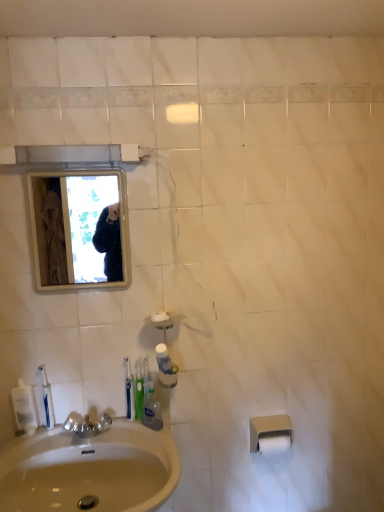
Find the location of a particular element. The height and width of the screenshot is (512, 384). beige ceramic sink at lower left is located at coordinates (89, 469).

Where is `clear plastic mouthwash at lower left, the second mouthwash from the right`? The width and height of the screenshot is (384, 512). clear plastic mouthwash at lower left, the second mouthwash from the right is located at coordinates (45, 399).

Image resolution: width=384 pixels, height=512 pixels. I want to click on green plastic toothbrush at sink, the first toothbrush when ordered from right to left, so coord(139,390).

I want to click on clear plastic mouthwash at lower left, marked as the first mouthwash in a left-to-right arrangement, so click(25, 407).

Where is `beige ceramic sink at lower left`? Image resolution: width=384 pixels, height=512 pixels. beige ceramic sink at lower left is located at coordinates (89, 469).

Does white matte toilet paper at lower right, marked as the first toilet paper in a bottom-to-top arrangement, contain beige matte toilet paper at lower right, positioned as the first toilet paper in top-to-bottom order?

No.

Is white matte toilet paper at lower right, which appears as the second toilet paper when viewed from the top, looking in the opposite direction of beige matte toilet paper at lower right, positioned as the first toilet paper in top-to-bottom order?

Correct, white matte toilet paper at lower right, which appears as the second toilet paper when viewed from the top, is looking away from beige matte toilet paper at lower right, positioned as the first toilet paper in top-to-bottom order.

Is white matte toilet paper at lower right, which appears as the second toilet paper when viewed from the top, to the left or to the right of beige matte toilet paper at lower right, arranged as the 2th toilet paper when ordered from the bottom, in the image?

white matte toilet paper at lower right, which appears as the second toilet paper when viewed from the top, is positioned on beige matte toilet paper at lower right, arranged as the 2th toilet paper when ordered from the bottom,'s right side.

In terms of height, does white matte toilet paper at lower right, marked as the first toilet paper in a bottom-to-top arrangement, look taller or shorter compared to beige matte toilet paper at lower right, arranged as the 2th toilet paper when ordered from the bottom?

white matte toilet paper at lower right, marked as the first toilet paper in a bottom-to-top arrangement, is shorter than beige matte toilet paper at lower right, arranged as the 2th toilet paper when ordered from the bottom.

Can you tell me how much beige matte toilet paper at lower right, positioned as the first toilet paper in top-to-bottom order, and white plastic toothbrush at lower left, which is the 2th toothbrush from right to left, differ in facing direction?

0.502 degrees.

Is beige matte toilet paper at lower right, positioned as the first toilet paper in top-to-bottom order, positioned beyond the bounds of white plastic toothbrush at lower left, which is the 2th toothbrush from right to left?

beige matte toilet paper at lower right, positioned as the first toilet paper in top-to-bottom order, lies outside white plastic toothbrush at lower left, which is the 2th toothbrush from right to left,'s area.

Locate an element on the screen. the 1st toilet paper positioned below the white plastic toothbrush at lower left, the first toothbrush in the left-to-right sequence (from the image's perspective) is located at coordinates (270, 434).

From the picture: Does white matte toilet paper at lower right, marked as the first toilet paper in a bottom-to-top arrangement, have a lesser height compared to white plastic toothbrush at lower left, the first toothbrush in the left-to-right sequence?

Indeed, white matte toilet paper at lower right, marked as the first toilet paper in a bottom-to-top arrangement, has a lesser height compared to white plastic toothbrush at lower left, the first toothbrush in the left-to-right sequence.

From the image's perspective, is white matte toilet paper at lower right, which appears as the second toilet paper when viewed from the top, on top of white plastic toothbrush at lower left, the first toothbrush in the left-to-right sequence?

No, from the image's perspective, white matte toilet paper at lower right, which appears as the second toilet paper when viewed from the top, is not on top of white plastic toothbrush at lower left, the first toothbrush in the left-to-right sequence.

Which is nearer, [271,446] or [125,360]?

Clearly, point [271,446] is more distant from the camera than point [125,360].

Is the position of white matte toilet paper at lower right, which appears as the second toilet paper when viewed from the top, more distant than that of white plastic toothbrush at lower left, the first toothbrush in the left-to-right sequence?

That is True.

Is white matte toilet paper at lower right, marked as the first toilet paper in a bottom-to-top arrangement, thinner than clear plastic mouthwash at lower left, marked as the first mouthwash in a left-to-right arrangement?

Incorrect, the width of white matte toilet paper at lower right, marked as the first toilet paper in a bottom-to-top arrangement, is not less than that of clear plastic mouthwash at lower left, marked as the first mouthwash in a left-to-right arrangement.

Choose the correct answer: Is white matte toilet paper at lower right, which appears as the second toilet paper when viewed from the top, inside clear plastic mouthwash at lower left, marked as the first mouthwash in a left-to-right arrangement, or outside it?

white matte toilet paper at lower right, which appears as the second toilet paper when viewed from the top, is located beyond the bounds of clear plastic mouthwash at lower left, marked as the first mouthwash in a left-to-right arrangement.

Consider the image. Which is more to the right, white matte toilet paper at lower right, marked as the first toilet paper in a bottom-to-top arrangement, or beige ceramic sink at lower left?

white matte toilet paper at lower right, marked as the first toilet paper in a bottom-to-top arrangement, is more to the right.

Is there a large distance between white matte toilet paper at lower right, marked as the first toilet paper in a bottom-to-top arrangement, and beige ceramic sink at lower left?

white matte toilet paper at lower right, marked as the first toilet paper in a bottom-to-top arrangement, is actually quite close to beige ceramic sink at lower left.

Which object is closer to the camera taking this photo, white matte toilet paper at lower right, marked as the first toilet paper in a bottom-to-top arrangement, or beige ceramic sink at lower left?

Positioned in front is beige ceramic sink at lower left.

Is white matte toilet paper at lower right, which appears as the second toilet paper when viewed from the top, positioned with its back to beige ceramic sink at lower left?

No, white matte toilet paper at lower right, which appears as the second toilet paper when viewed from the top, is not facing away from beige ceramic sink at lower left.

Which of these two, clear plastic mouthwash at lower left, marked as the first mouthwash in a left-to-right arrangement, or translucent plastic mouthwash at lower center, which is the 3th mouthwash from left to right, is thinner?

clear plastic mouthwash at lower left, marked as the first mouthwash in a left-to-right arrangement.

Can you tell me how much clear plastic mouthwash at lower left, the 3th mouthwash when ordered from right to left, and translucent plastic mouthwash at lower center, which is the 3th mouthwash from left to right, differ in facing direction?

There is a 48.4-degree angle between the facing directions of clear plastic mouthwash at lower left, the 3th mouthwash when ordered from right to left, and translucent plastic mouthwash at lower center, which is the 3th mouthwash from left to right.

Could you measure the distance between clear plastic mouthwash at lower left, the 3th mouthwash when ordered from right to left, and translucent plastic mouthwash at lower center, the first mouthwash from the right?

clear plastic mouthwash at lower left, the 3th mouthwash when ordered from right to left, and translucent plastic mouthwash at lower center, the first mouthwash from the right, are 41.83 centimeters apart from each other.

Where is `mouthwash that is below the translucent plastic mouthwash at lower center, the first mouthwash from the right (from the image's perspective)`? The image size is (384, 512). mouthwash that is below the translucent plastic mouthwash at lower center, the first mouthwash from the right (from the image's perspective) is located at coordinates (25, 407).

From the picture: Considering the sizes of objects beige ceramic sink at lower left and green plastic toothbrush at sink, the second toothbrush in the left-to-right sequence, in the image provided, who is thinner, beige ceramic sink at lower left or green plastic toothbrush at sink, the second toothbrush in the left-to-right sequence,?

green plastic toothbrush at sink, the second toothbrush in the left-to-right sequence, is thinner.

Is beige ceramic sink at lower left aimed at green plastic toothbrush at sink, the first toothbrush when ordered from right to left?

No, beige ceramic sink at lower left is not facing towards green plastic toothbrush at sink, the first toothbrush when ordered from right to left.

Consider the image. Is beige ceramic sink at lower left shorter than green plastic toothbrush at sink, the first toothbrush when ordered from right to left?

In fact, beige ceramic sink at lower left may be taller than green plastic toothbrush at sink, the first toothbrush when ordered from right to left.

Considering the sizes of objects beige ceramic sink at lower left and green plastic toothbrush at sink, the second toothbrush in the left-to-right sequence, in the image provided, who is bigger, beige ceramic sink at lower left or green plastic toothbrush at sink, the second toothbrush in the left-to-right sequence,?

beige ceramic sink at lower left.

Locate an element on the screen. The height and width of the screenshot is (512, 384). toilet paper on the right of beige matte toilet paper at lower right, arranged as the 2th toilet paper when ordered from the bottom is located at coordinates click(x=274, y=444).

Where is `the 1st toothbrush positioned above the beige matte toilet paper at lower right, arranged as the 2th toilet paper when ordered from the bottom (from the image's perspective)`? This screenshot has height=512, width=384. the 1st toothbrush positioned above the beige matte toilet paper at lower right, arranged as the 2th toilet paper when ordered from the bottom (from the image's perspective) is located at coordinates click(x=129, y=389).

When comparing their distances from translucent plastic mouthwash at lower center, which is the 3th mouthwash from left to right, does white matte toilet paper at lower right, which appears as the second toilet paper when viewed from the top, or beige matte toilet paper at lower right, positioned as the first toilet paper in top-to-bottom order, seem further?

Based on the image, white matte toilet paper at lower right, which appears as the second toilet paper when viewed from the top, appears to be further to translucent plastic mouthwash at lower center, which is the 3th mouthwash from left to right.

Looking at the image, which one is located closer to clear plastic mouthwash at lower left, the 2th mouthwash when ordered from left to right, white matte toilet paper at lower right, marked as the first toilet paper in a bottom-to-top arrangement, or translucent plastic mouthwash at lower center, the first mouthwash from the right?

Based on the image, translucent plastic mouthwash at lower center, the first mouthwash from the right, appears to be nearer to clear plastic mouthwash at lower left, the 2th mouthwash when ordered from left to right.

In the scene shown: Considering their positions, is translucent plastic mouthwash at lower center, which is the 3th mouthwash from left to right, positioned further to white matte toilet paper at lower right, which appears as the second toilet paper when viewed from the top, than beige ceramic sink at lower left?

beige ceramic sink at lower left is positioned further to the anchor white matte toilet paper at lower right, which appears as the second toilet paper when viewed from the top.

Which object lies further to the anchor point clear plastic mouthwash at lower left, the 3th mouthwash when ordered from right to left, white matte soap at center or beige matte toilet paper at lower right, positioned as the first toilet paper in top-to-bottom order?

beige matte toilet paper at lower right, positioned as the first toilet paper in top-to-bottom order.

Looking at this image, looking at the image, which one is located closer to clear plastic mouthwash at lower left, the 2th mouthwash when ordered from left to right, white plastic toothbrush at lower left, which is the 2th toothbrush from right to left, or translucent plastic mouthwash at lower center, which is the 3th mouthwash from left to right?

white plastic toothbrush at lower left, which is the 2th toothbrush from right to left, is positioned closer to the anchor clear plastic mouthwash at lower left, the 2th mouthwash when ordered from left to right.

Which object lies nearer to the anchor point translucent plastic mouthwash at lower center, the first mouthwash from the right, clear plastic mouthwash at lower left, marked as the first mouthwash in a left-to-right arrangement, or white glossy mirror at upper left?

Based on the image, clear plastic mouthwash at lower left, marked as the first mouthwash in a left-to-right arrangement, appears to be nearer to translucent plastic mouthwash at lower center, the first mouthwash from the right.

Considering their positions, is clear plastic mouthwash at lower left, the 3th mouthwash when ordered from right to left, positioned further to clear plastic mouthwash at lower left, the second mouthwash from the right, than beige matte toilet paper at lower right, positioned as the first toilet paper in top-to-bottom order?

Based on the image, beige matte toilet paper at lower right, positioned as the first toilet paper in top-to-bottom order, appears to be further to clear plastic mouthwash at lower left, the second mouthwash from the right.

When comparing their distances from green plastic toothbrush at sink, the second toothbrush in the left-to-right sequence, does white matte soap at center or beige matte toilet paper at lower right, positioned as the first toilet paper in top-to-bottom order, seem further?

beige matte toilet paper at lower right, positioned as the first toilet paper in top-to-bottom order, is further to green plastic toothbrush at sink, the second toothbrush in the left-to-right sequence.

Locate an element on the screen. The image size is (384, 512). soap between white plastic toothbrush at lower left, the first toothbrush in the left-to-right sequence, and white matte toilet paper at lower right, which appears as the second toilet paper when viewed from the top is located at coordinates pos(160,317).

Where is `sink situated between clear plastic mouthwash at lower left, marked as the first mouthwash in a left-to-right arrangement, and white matte toilet paper at lower right, which appears as the second toilet paper when viewed from the top, from left to right`? sink situated between clear plastic mouthwash at lower left, marked as the first mouthwash in a left-to-right arrangement, and white matte toilet paper at lower right, which appears as the second toilet paper when viewed from the top, from left to right is located at coordinates (89, 469).

The height and width of the screenshot is (512, 384). Find the location of `mouthwash located between beige ceramic sink at lower left and white matte toilet paper at lower right, which appears as the second toilet paper when viewed from the top, in the left-right direction`. mouthwash located between beige ceramic sink at lower left and white matte toilet paper at lower right, which appears as the second toilet paper when viewed from the top, in the left-right direction is located at coordinates (152, 412).

Find the location of a particular element. The image size is (384, 512). soap situated between translucent plastic mouthwash at lower center, the first mouthwash from the right, and white matte toilet paper at lower right, marked as the first toilet paper in a bottom-to-top arrangement, from left to right is located at coordinates (160, 317).